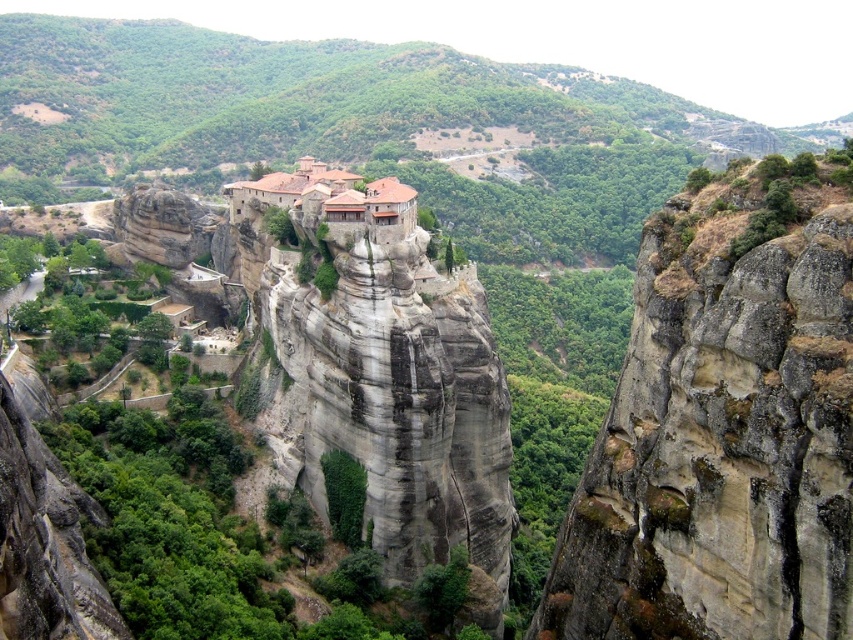
Question: Which point is farther to the camera?

Choices:
 (A) (245, 198)
 (B) (641, 291)

Answer: (A)

Question: Can you confirm if gray rocky cliff at upper right is positioned above brown clay roof at center?

Choices:
 (A) yes
 (B) no

Answer: (B)

Question: Which point is closer to the camera?

Choices:
 (A) brown clay roof at center
 (B) gray rocky cliff at upper right

Answer: (B)

Question: Does gray rocky cliff at upper right have a larger size compared to brown clay roof at center?

Choices:
 (A) no
 (B) yes

Answer: (B)

Question: Does gray rocky cliff at upper right have a smaller size compared to brown clay roof at center?

Choices:
 (A) no
 (B) yes

Answer: (A)

Question: Which point is farther to the camera?

Choices:
 (A) brown clay roof at center
 (B) gray rocky cliff at upper right

Answer: (A)